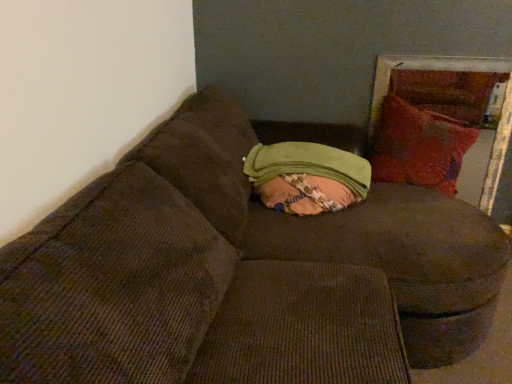
Question: Is green fabric bean bag at center bigger or smaller than velvet red pillow at right?

Choices:
 (A) small
 (B) big

Answer: (A)

Question: From the image's perspective, is green fabric bean bag at center positioned above or below velvet red pillow at right?

Choices:
 (A) below
 (B) above

Answer: (A)

Question: From a real-world perspective, is green fabric bean bag at center above or below velvet red pillow at right?

Choices:
 (A) below
 (B) above

Answer: (A)

Question: Would you say velvet red pillow at right is to the left or to the right of green fabric bean bag at center in the picture?

Choices:
 (A) left
 (B) right

Answer: (B)

Question: In terms of height, does velvet red pillow at right look taller or shorter compared to green fabric bean bag at center?

Choices:
 (A) short
 (B) tall

Answer: (B)

Question: Is point (386, 117) positioned closer to the camera than point (294, 192)?

Choices:
 (A) farther
 (B) closer

Answer: (A)

Question: From the image's perspective, is velvet red pillow at right above or below green fabric bean bag at center?

Choices:
 (A) above
 (B) below

Answer: (A)